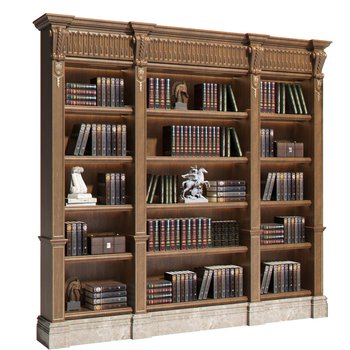
Locate an element on the screen. This screenshot has width=350, height=350. decor is located at coordinates (72, 292), (76, 185), (192, 184), (179, 96), (284, 144), (111, 240).